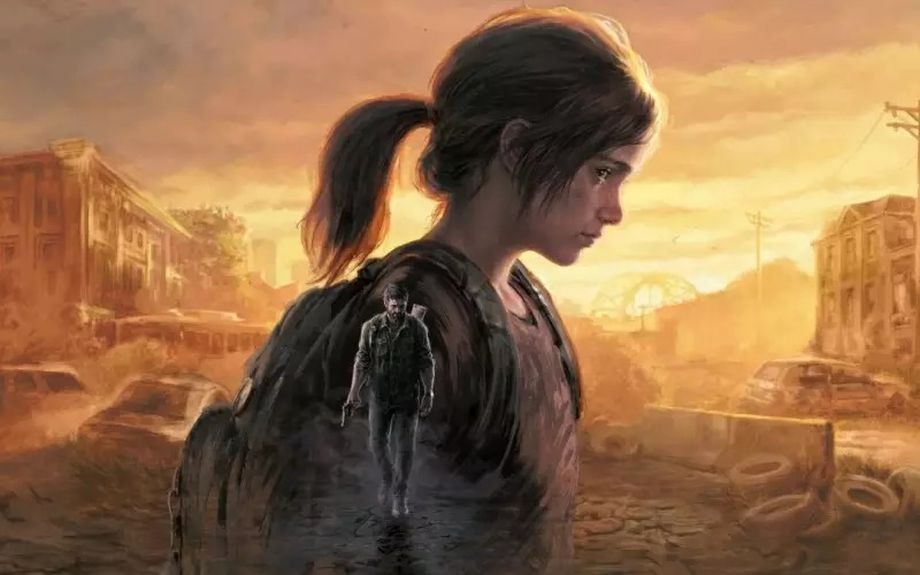
Identify the location of window. The image size is (920, 575). (52, 244).